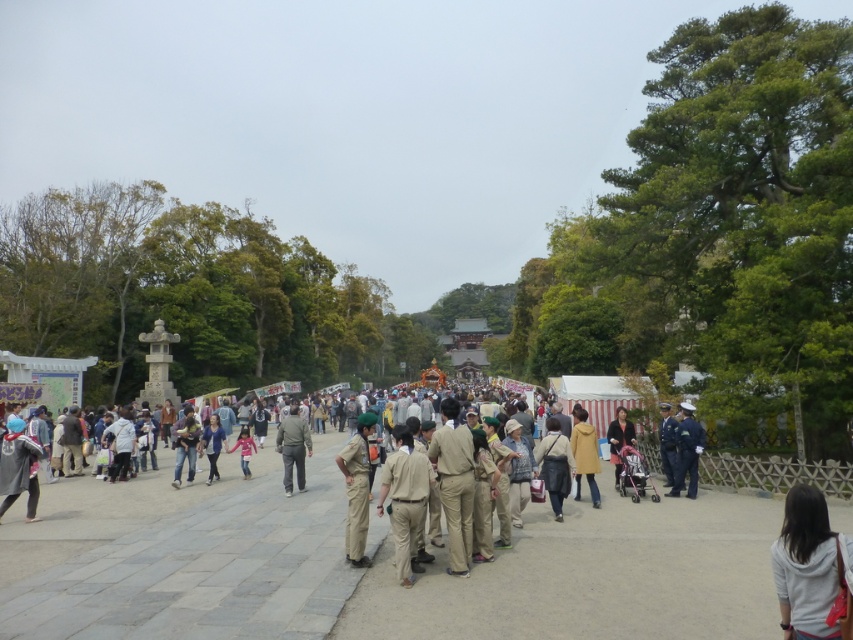
You are an event organizer assessing the clothing thickness of attendees for weather preparation. You notice a white cotton hoodie at lower right and a blue uniform at center. Which clothing item is less thick?

The white cotton hoodie at lower right is thinner than the blue uniform at center.

Consider the image. You are at the festival and want to find a coat that is smaller in size between the light brown fabric coat at center and the dark brown leather jacket at lower right. Which one should you choose?

The light brown fabric coat at center is smaller than the dark brown leather jacket at lower right, so you should choose the light brown fabric coat at center.

You are attending a festival and notice two people in the crowd. One is wearing a gray fabric jacket at center and the other is in a blue uniform at center. From your perspective, which one is positioned more to the left?

The gray fabric jacket at center is positioned more to the left compared to the blue uniform at center.